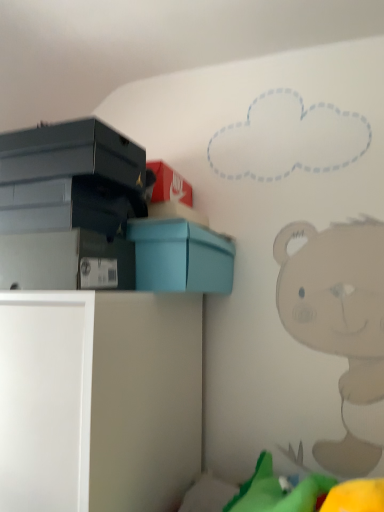
Question: Can we say matte blue box at upper left lies outside white matte cabinet at lower left?

Choices:
 (A) yes
 (B) no

Answer: (A)

Question: Does matte blue box at upper left touch white matte cabinet at lower left?

Choices:
 (A) yes
 (B) no

Answer: (B)

Question: Considering the relative sizes of matte blue box at upper left and white matte cabinet at lower left in the image provided, is matte blue box at upper left bigger than white matte cabinet at lower left?

Choices:
 (A) yes
 (B) no

Answer: (B)

Question: From the image's perspective, is matte blue box at upper left above white matte cabinet at lower left?

Choices:
 (A) yes
 (B) no

Answer: (A)

Question: Can you confirm if matte blue box at upper left is taller than white matte cabinet at lower left?

Choices:
 (A) yes
 (B) no

Answer: (B)

Question: Considering the relative positions of matte blue box at upper left and white matte cabinet at lower left in the image provided, is matte blue box at upper left in front of white matte cabinet at lower left?

Choices:
 (A) yes
 (B) no

Answer: (B)

Question: From the image's perspective, does white matte cabinet at lower left appear lower than matte blue box at upper left?

Choices:
 (A) yes
 (B) no

Answer: (A)

Question: From a real-world perspective, does white matte cabinet at lower left sit lower than matte blue box at upper left?

Choices:
 (A) yes
 (B) no

Answer: (A)

Question: Considering the relative sizes of white matte cabinet at lower left and matte blue box at upper left in the image provided, is white matte cabinet at lower left smaller than matte blue box at upper left?

Choices:
 (A) no
 (B) yes

Answer: (A)

Question: From the image's perspective, is white matte cabinet at lower left above matte blue box at upper left?

Choices:
 (A) no
 (B) yes

Answer: (A)

Question: Could matte blue box at upper left be considered to be inside white matte cabinet at lower left?

Choices:
 (A) no
 (B) yes

Answer: (A)

Question: From a real-world perspective, is white matte cabinet at lower left positioned over matte blue box at upper left based on gravity?

Choices:
 (A) no
 (B) yes

Answer: (A)

Question: Is matte gray storage box at lower left inside matte blue box at upper left?

Choices:
 (A) yes
 (B) no

Answer: (B)